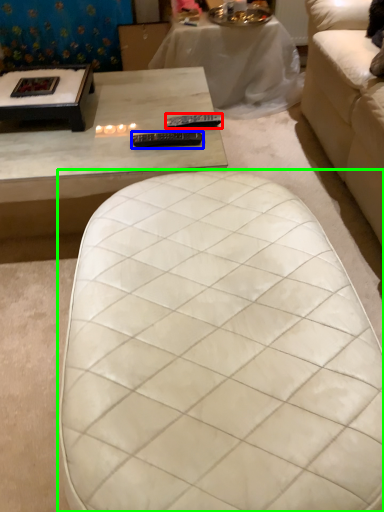
Question: Which object is the closest to the remote (highlighted by a red box)? Choose among these: remote (highlighted by a blue box) or table (highlighted by a green box).

Choices:
 (A) remote
 (B) table

Answer: (A)